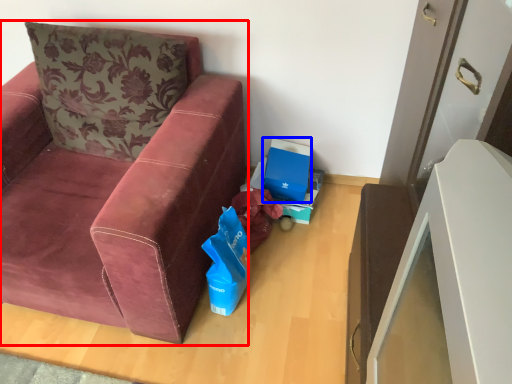
Question: Which of the following is the closest to the observer, studio couch (highlighted by a red box) or cardboard box (highlighted by a blue box)?

Choices:
 (A) studio couch
 (B) cardboard box

Answer: (A)